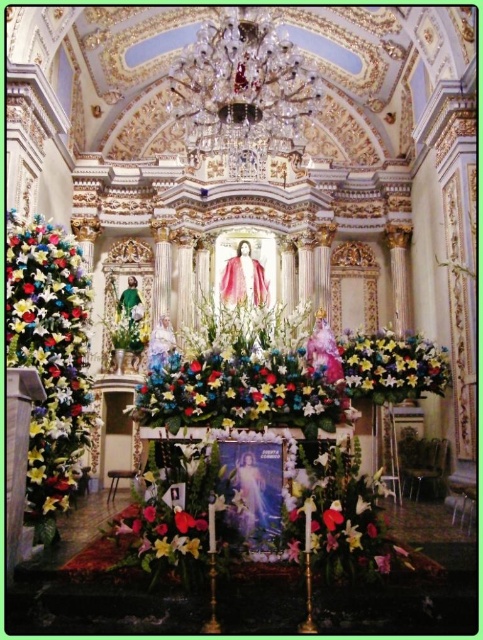
You are an event planner setting up for a church service. You need to place a large banner behind the floral bouquet at left and floral arrangement at center. Based on their positions, which one should the banner be placed behind to ensure it is visible from the pews in the back?

The banner should be placed behind the floral arrangement at center because the floral bouquet at left is in front of it, so placing the banner behind the one at center ensures visibility from the back pews.

You are a visitor standing at the entrance of the church and want to place a new floral bouquet at left next to the existing one. The new bouquet is 1.5 feet wide. Is there enough space between them?

The existing floral bouquet at left and the new bouquet are 155.41 feet apart, so there is more than enough space to place the new bouquet next to the existing one.